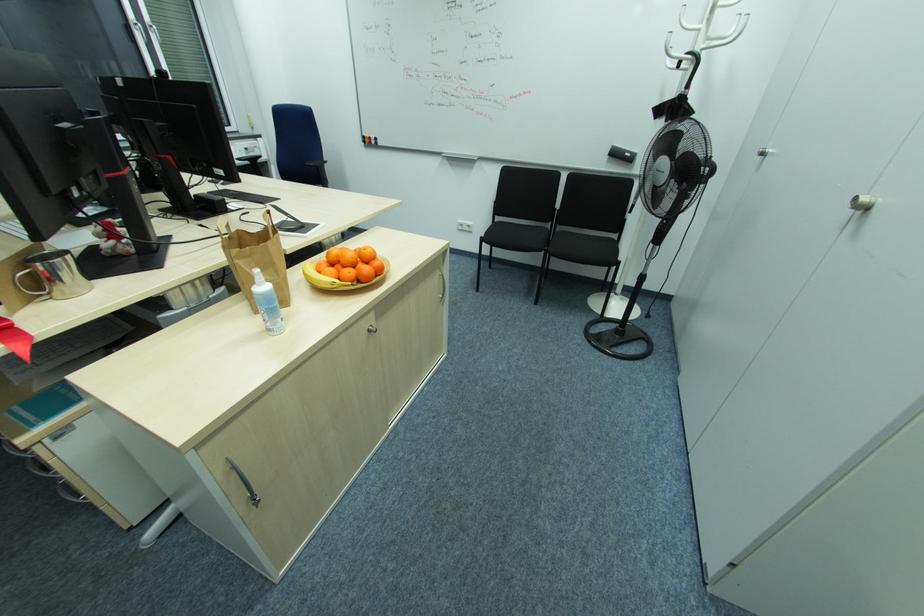
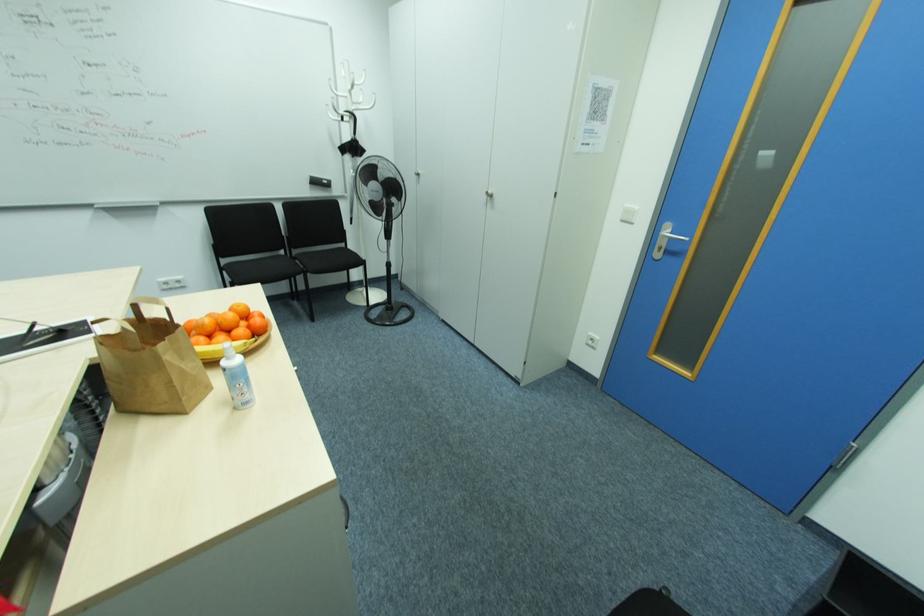
Question: The first image is from the beginning of the video and the second image is from the end. How did the camera likely rotate when shooting the video?

Choices:
 (A) Left
 (B) Right
 (C) Up
 (D) Down

Answer: (B)